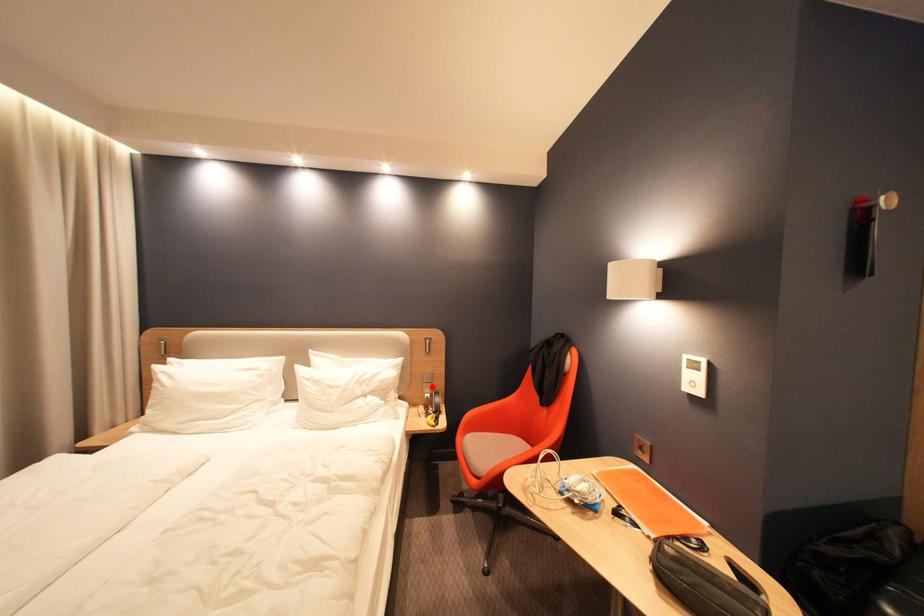
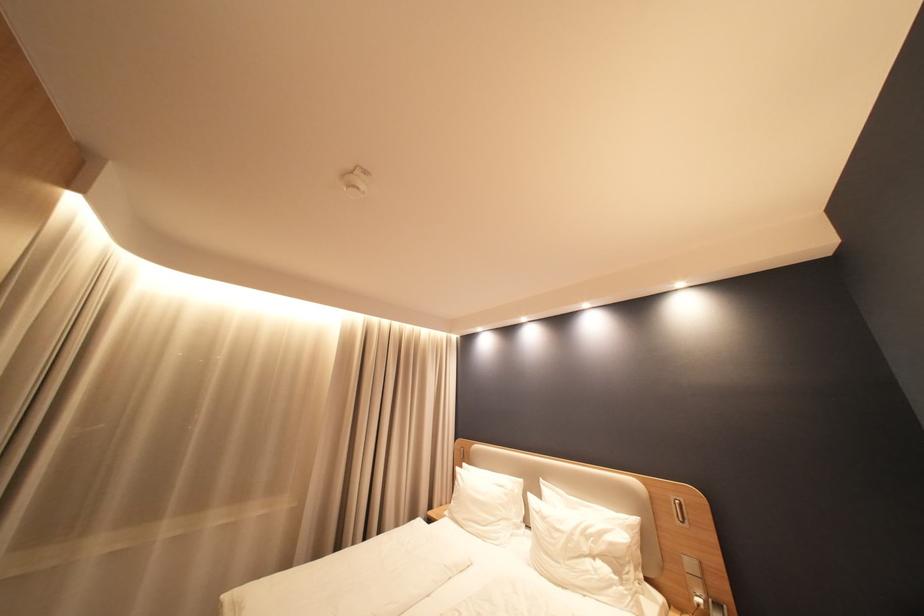
Question: I am providing you with two images of the same scene from different viewpoints. A red point is shown in image1. For the corresponding object point in image2, is it positioned nearer or farther from the camera?

Choices:
 (A) Nearer
 (B) Farther

Answer: (A)